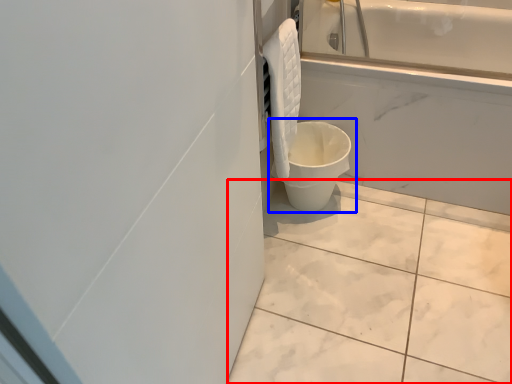
Question: Which of the following is the farthest to the observer, ceramic tile (highlighted by a red box) or toilet (highlighted by a blue box)?

Choices:
 (A) ceramic tile
 (B) toilet

Answer: (B)